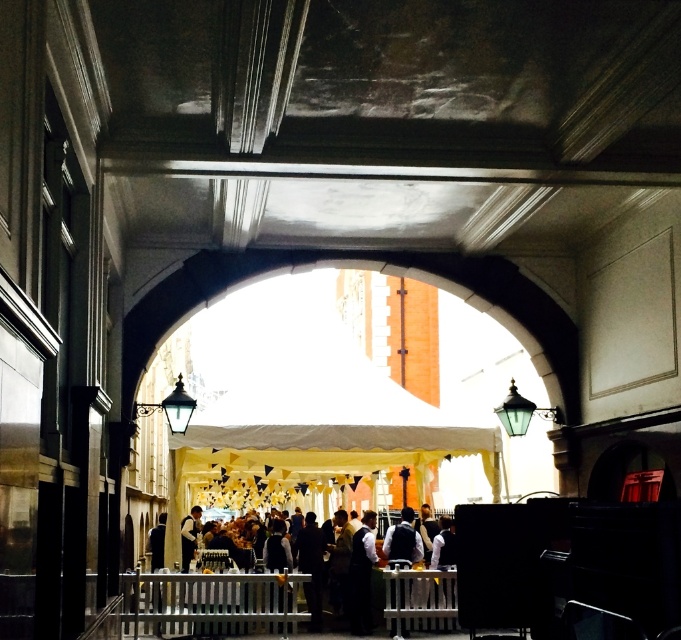
You are standing at the entrance of the arched passageway and see a dark gray suit at center and a white shirt at center. Which clothing item is closer to you?

The dark gray suit at center is closer to you because it is in front of the white shirt at center.

You are standing at the entrance of the arched passageway and want to take a photo of two points marked in the scene. The first point is at coordinates point (407, 525) and the second is at point (193, 529). Which point should you focus on first to ensure both are in sharp focus?

Point (407, 525) is closer to the camera than point (193, 529). To ensure both points are in sharp focus, you should focus on the closer point (407, 525) first.